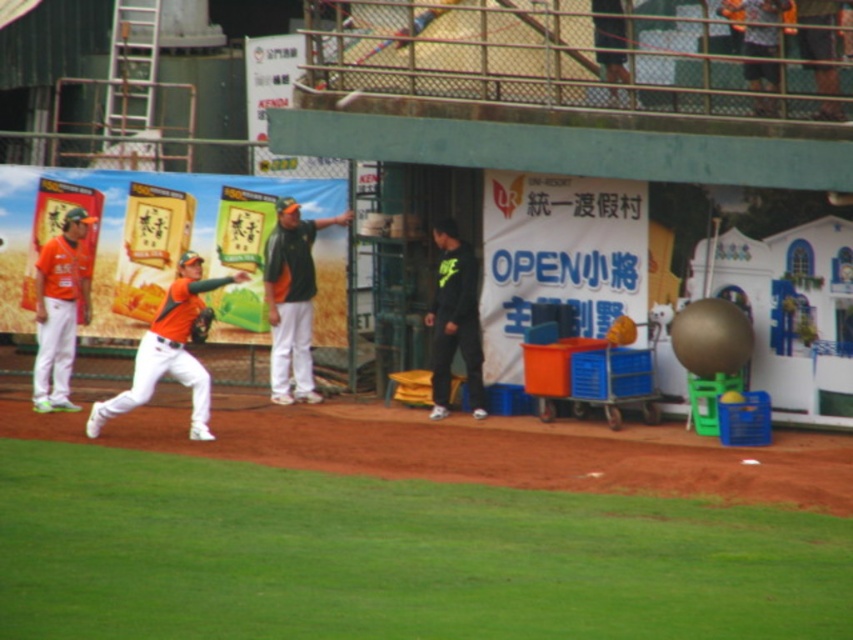
You are a photographer trying to capture the player in the orange jersey. You notice the black matte pants at center and the orange fabric baseball glove at center. Which object should you focus on if you want to photograph something taller?

The black matte pants at center has a greater height compared to the orange fabric baseball glove at center, so you should focus on the black matte pants at center as it is taller.

You are a photographer at the baseball field. You need to capture a photo of the orange jersey at center and the black matte pants at center. Based on their positions, which object should be in the foreground and which should be in the background?

The orange jersey at center should be in the foreground and the black matte pants at center should be in the background because the black matte pants at center is behind orange jersey at center.

You are a coach observing the baseball practice. You notice two orange baseball gloves at the center of the field. Which one is closer to you, the orange matte baseball glove at center or the orange fabric baseball glove at center?

The orange matte baseball glove at center is closer to you because it is in front of the orange fabric baseball glove at center.